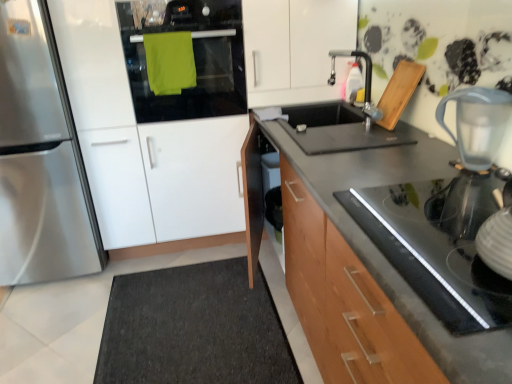
The width and height of the screenshot is (512, 384). What are the coordinates of `empty space that is ontop of black glass cooktop at lower right` in the screenshot? It's located at (431, 236).